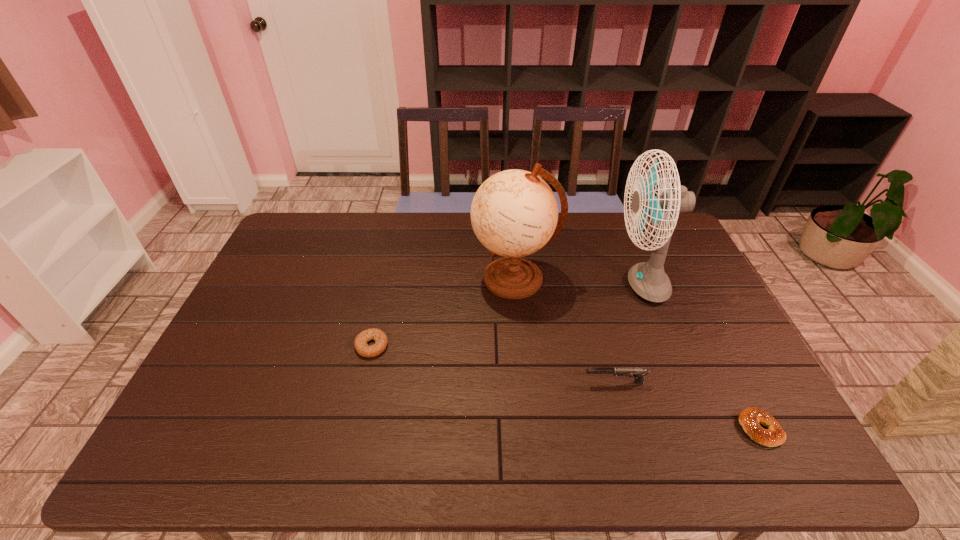
This screenshot has height=540, width=960. I want to click on fan that is at the right edge, so click(x=648, y=279).

What are the coordinates of `bagel present at the right edge` in the screenshot? It's located at (749, 418).

This screenshot has height=540, width=960. Identify the location of object at the near right corner. (749, 418).

Identify the location of vacant space at the far edge. (431, 224).

In the image, there is a desktop. Identify the location of vacant space at the near edge. This screenshot has width=960, height=540. (x=566, y=451).

This screenshot has height=540, width=960. In order to click on blank area at the left edge in this screenshot , I will do `click(228, 416)`.

This screenshot has height=540, width=960. I want to click on vacant area at the right edge of the desktop, so click(x=667, y=309).

Locate an element on the screen. The image size is (960, 540). vacant space at the far left corner of the desktop is located at coordinates (312, 237).

In the image, there is a desktop. Find the location of `vacant space at the far right corner`. vacant space at the far right corner is located at coordinates (677, 239).

Where is `blank space at the near right corner of the desktop`? The image size is (960, 540). blank space at the near right corner of the desktop is located at coordinates (736, 438).